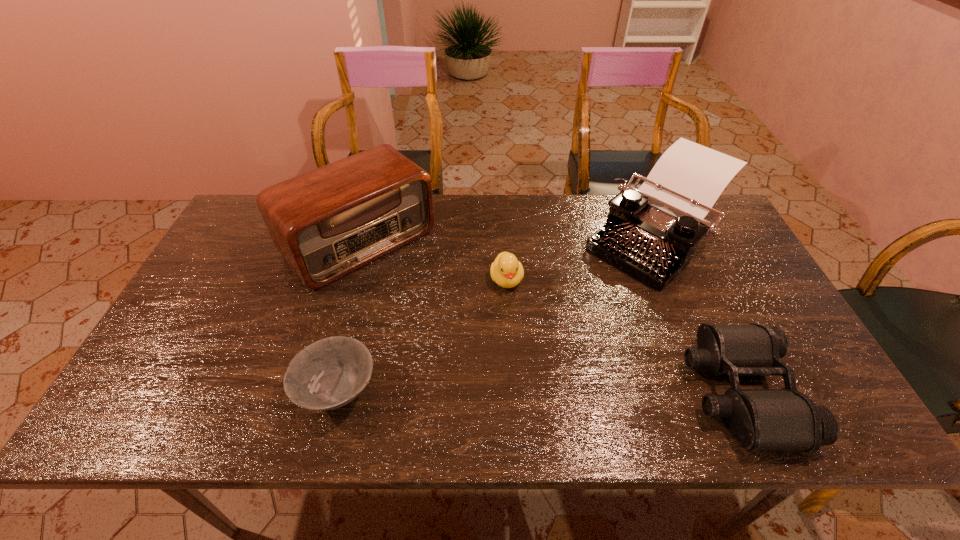
Image resolution: width=960 pixels, height=540 pixels. Identify the location of free space on the desktop that is between the bowl and the binoculars and is positioned on the keys of the typewriter. (484, 392).

Where is `vacant spot on the desktop that is between the bowl and the binoculars and is positioned on the front panel of the radio receiver`? vacant spot on the desktop that is between the bowl and the binoculars and is positioned on the front panel of the radio receiver is located at coordinates (507, 392).

This screenshot has height=540, width=960. I want to click on vacant spot on the desktop that is between the bowl and the binoculars and is positioned on the beak of the duckling, so click(x=526, y=392).